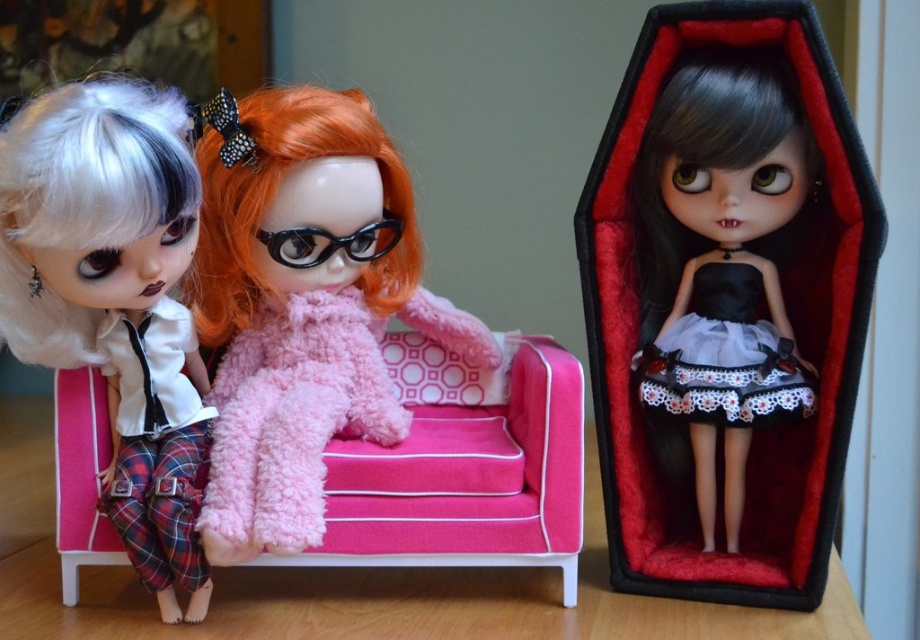
Can you confirm if black lace dress at center is smaller than black glossy glasses at center?

No, black lace dress at center is not smaller than black glossy glasses at center.

Does black lace dress at center have a lesser height compared to black glossy glasses at center?

No, black lace dress at center is not shorter than black glossy glasses at center.

Is point (749, 308) closer to viewer compared to point (301, 260)?

Yes, it is.

The image size is (920, 640). I want to click on black lace dress at center, so click(x=723, y=353).

Which is more to the right, black satin doll at center or black glossy glasses at center?

From the viewer's perspective, black satin doll at center appears more on the right side.

Does black satin doll at center have a smaller size compared to black glossy glasses at center?

No, black satin doll at center is not smaller than black glossy glasses at center.

Who is more forward, [777,515] or [324,257]?

Point [324,257] is in front.

The image size is (920, 640). Find the location of `black satin doll at center`. black satin doll at center is located at coordinates (726, 300).

Who is positioned more to the left, matte white doll at left or black lace dress at center?

matte white doll at left is more to the left.

Who is positioned more to the right, matte white doll at left or black lace dress at center?

black lace dress at center is more to the right.

Does point (8, 320) come in front of point (660, 365)?

Yes, point (8, 320) is closer to viewer.

Image resolution: width=920 pixels, height=640 pixels. What are the coordinates of `matte white doll at left` in the screenshot? It's located at (112, 288).